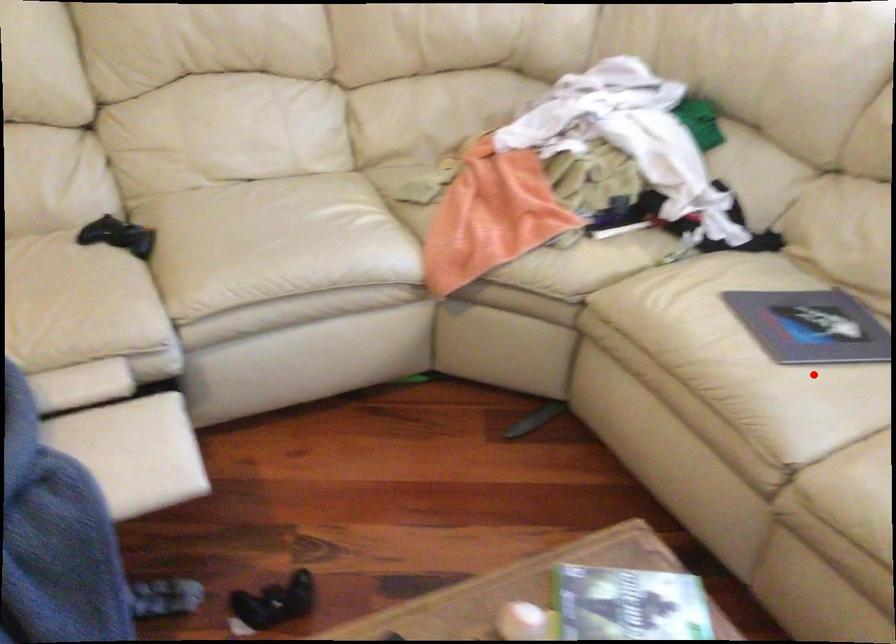
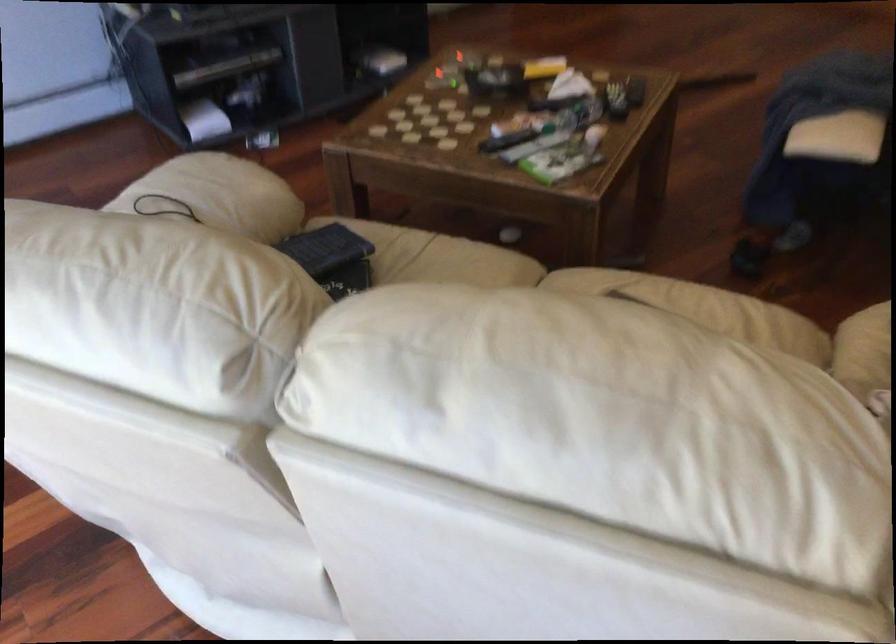
Locate, in the second image, the point that corresponds to the highlighted location in the first image.

(584, 285)